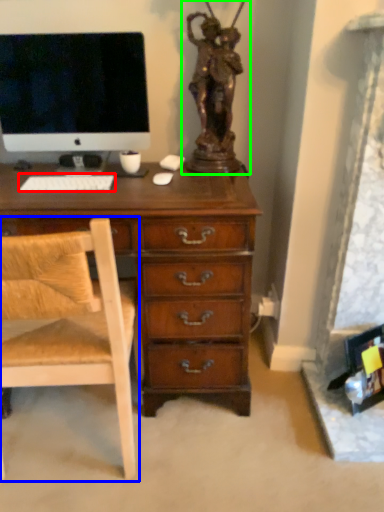
Question: Estimate the real-world distances between objects in this image. Which object is closer to computer keyboard (highlighted by a red box), chair (highlighted by a blue box) or sculpture (highlighted by a green box)?

Choices:
 (A) chair
 (B) sculpture

Answer: (A)